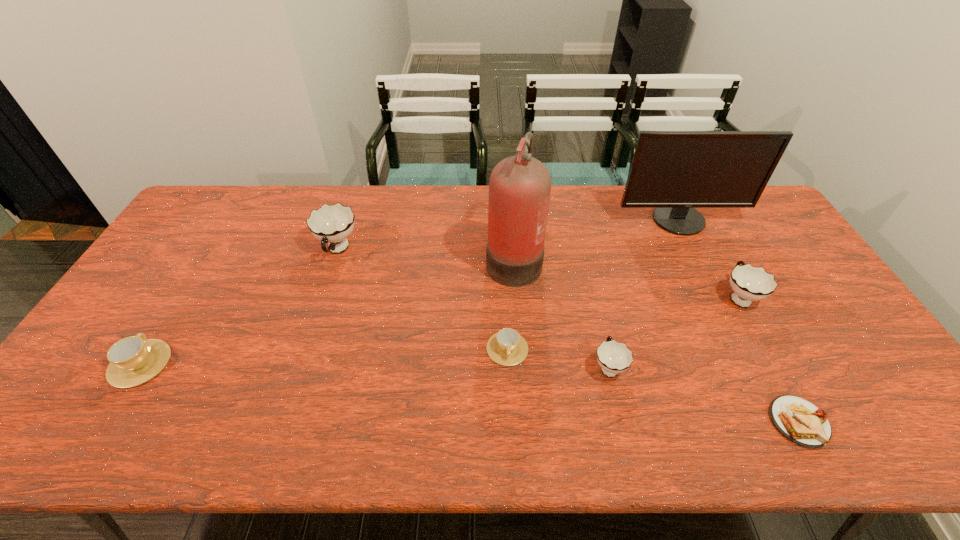
This screenshot has height=540, width=960. What are the coordinates of `fire extinguisher` in the screenshot? It's located at (520, 186).

The height and width of the screenshot is (540, 960). I want to click on the tallest object, so click(x=520, y=186).

You are a GUI agent. You are given a task and a screenshot of the screen. Output one action in this format:
    pyautogui.click(x=<x>, y=<y>)
    Task: Click on the monitor
    This screenshot has height=540, width=960.
    Given the screenshot: What is the action you would take?
    pyautogui.click(x=674, y=172)

I want to click on the farthest white cup, so click(332, 224).

The height and width of the screenshot is (540, 960). In order to click on the tallest cup in this screenshot , I will do `click(332, 224)`.

Locate an element on the screen. This screenshot has height=540, width=960. the fourth nearest cup is located at coordinates (749, 283).

The width and height of the screenshot is (960, 540). What are the coordinates of `the fourth shortest cup` in the screenshot? It's located at (749, 283).

Locate an element on the screen. This screenshot has width=960, height=540. the second cup from right to left is located at coordinates (614, 357).

Identify the location of the nearest white cup. The image size is (960, 540). (614, 357).

Locate an element on the screen. the bigger brown cup is located at coordinates (133, 360).